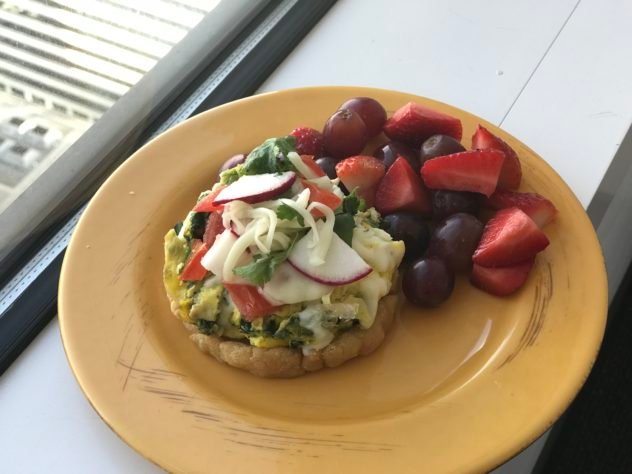
At what (x,y) coordinates should I click in order to perform the action: click on window. Please return your answer as a coordinate pair (x, y). The height and width of the screenshot is (474, 632). Looking at the image, I should click on (70, 63).